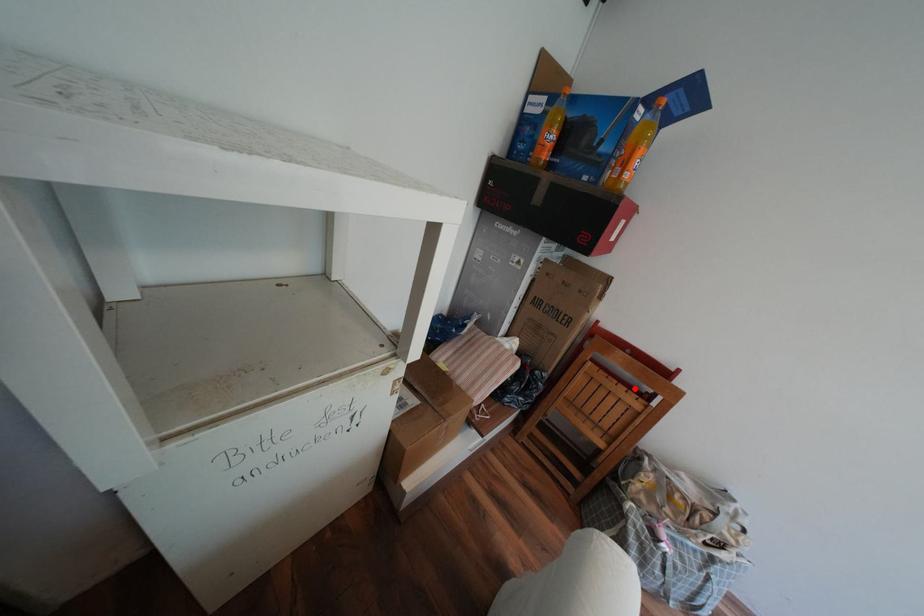
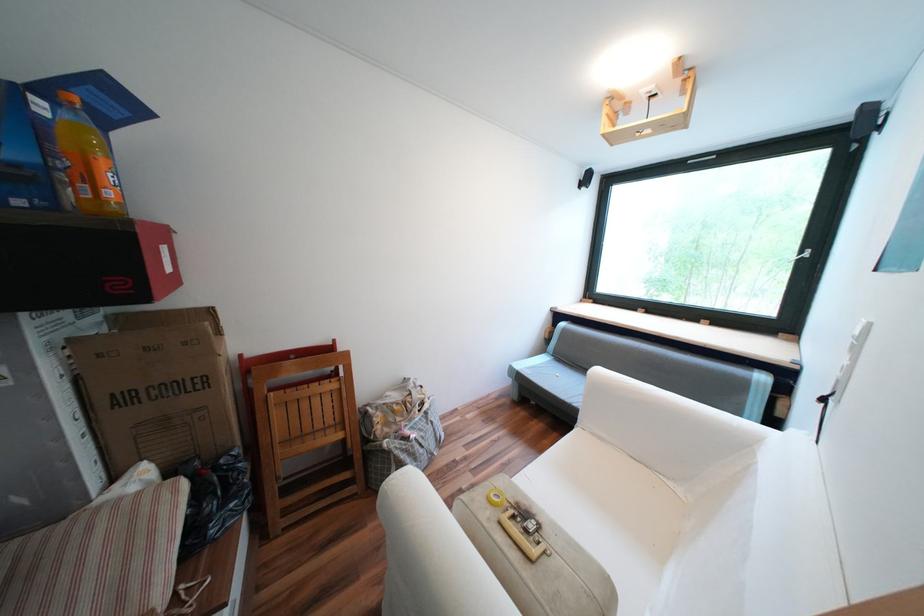
Locate, in the second image, the point that corresponds to the highlighted location in the first image.

(325, 383)